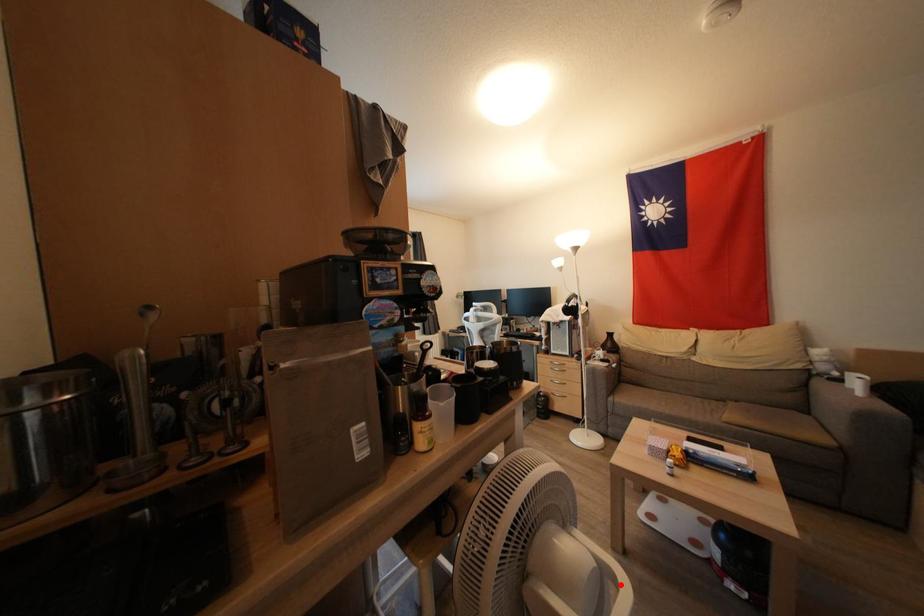
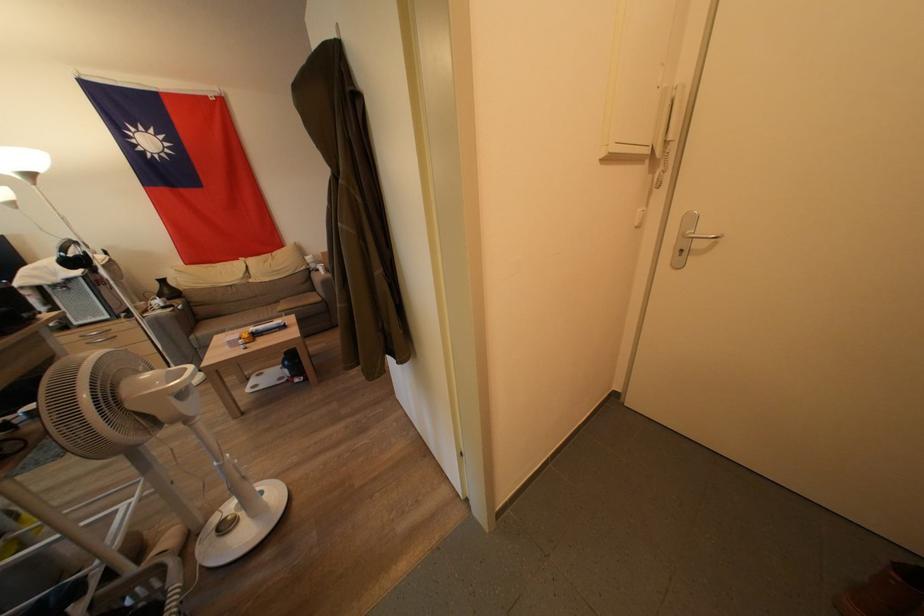
Question: I am providing you with two images of the same scene from different viewpoints. In image1, a red point is highlighted. Considering the same 3D point in image2, which of the following is correct?

Choices:
 (A) It is closer
 (B) It is farther

Answer: (A)